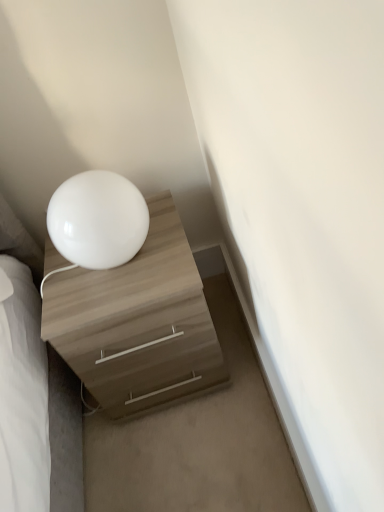
Find the location of a particular element. free space in front of white glossy table lamp at upper left is located at coordinates (115, 298).